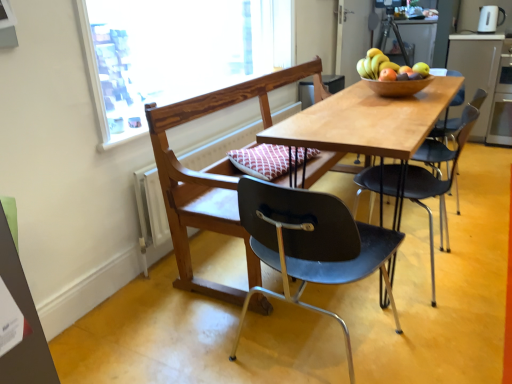
Locate an element on the screen. The width and height of the screenshot is (512, 384). vacant area situated to the left side of matte black chair at center, which appears as the first chair when viewed from the front is located at coordinates (192, 342).